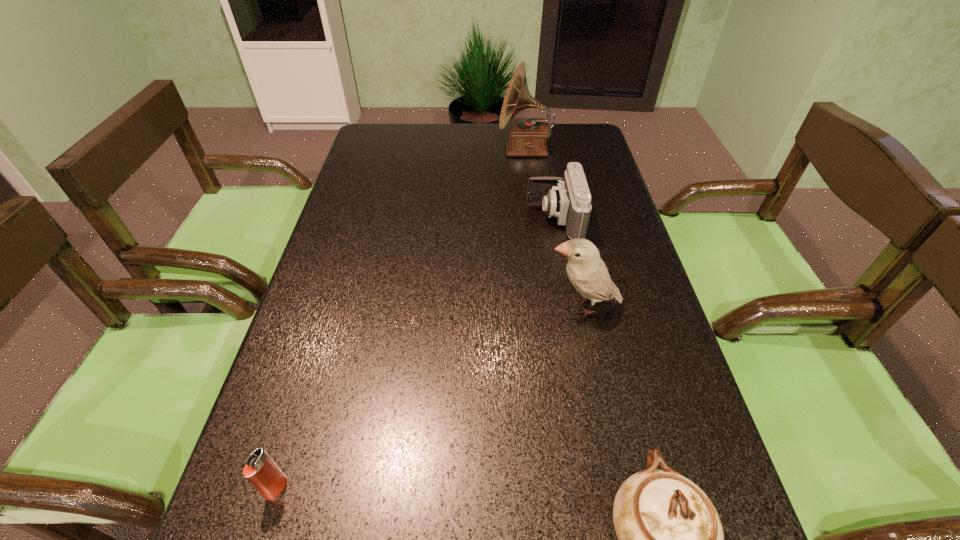
Find the location of a particular element. Image resolution: width=960 pixels, height=540 pixels. camera that is at the right edge is located at coordinates (569, 199).

Where is `object located at the far right corner`? The width and height of the screenshot is (960, 540). object located at the far right corner is located at coordinates (527, 136).

The height and width of the screenshot is (540, 960). In the image, there is a desktop. In order to click on vacant space at the far edge in this screenshot , I will do `click(446, 124)`.

The width and height of the screenshot is (960, 540). In the image, there is a desktop. In order to click on vacant space at the left edge in this screenshot , I will do `click(335, 265)`.

What are the coordinates of `vacant space at the right edge of the desktop` in the screenshot? It's located at (647, 306).

Identify the location of free spot at the far right corner of the desktop. (585, 131).

The image size is (960, 540). Find the location of `free space between the phonograph record and the igniter`. free space between the phonograph record and the igniter is located at coordinates [401, 318].

I want to click on free space between the igniter and the second farthest object, so click(416, 353).

Identify the location of empty space that is in between the camera and the igniter. (416, 353).

At what (x,y) coordinates should I click in order to perform the action: click on object that can be found as the third closest to the igniter. Please return your answer as a coordinate pair (x, y). This screenshot has width=960, height=540. Looking at the image, I should click on (569, 199).